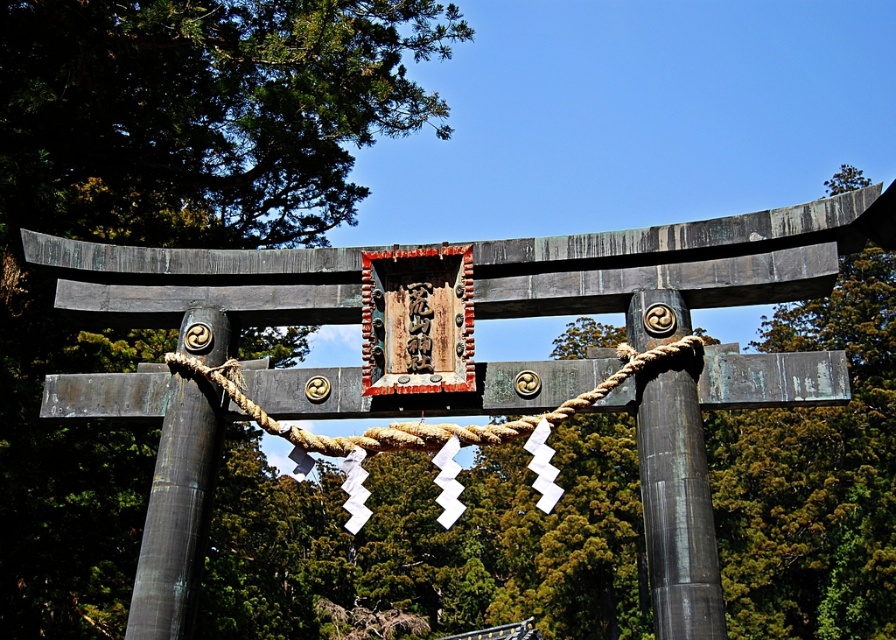
You are standing in front of the torii gate and need to locate the bronze textured pole at center. Where would you find it in relation to the gate?

The bronze textured pole at center is located at the center of the torii gate, positioned at the coordinate point 0.800 on the x axis and 0.199 on the y axis.

You are an architect designing a miniature model of this torii gate. You have two materials available for the central posts. The smooth dark wood post at center and the bronze textured pole at center. Which material should you choose if you want the post to appear thicker in the model?

The bronze textured pole at center is wider than the smooth dark wood post at center, so you should choose the bronze textured pole at center to make the post appear thicker in the model.

In the scene shown: You are a visitor at a Shinto shrine and notice the smooth dark wood post at center and the rope at center. Which object takes up more space in the image?

The rope at center takes up more space in the image because the smooth dark wood post at center occupies less space than rope at center.